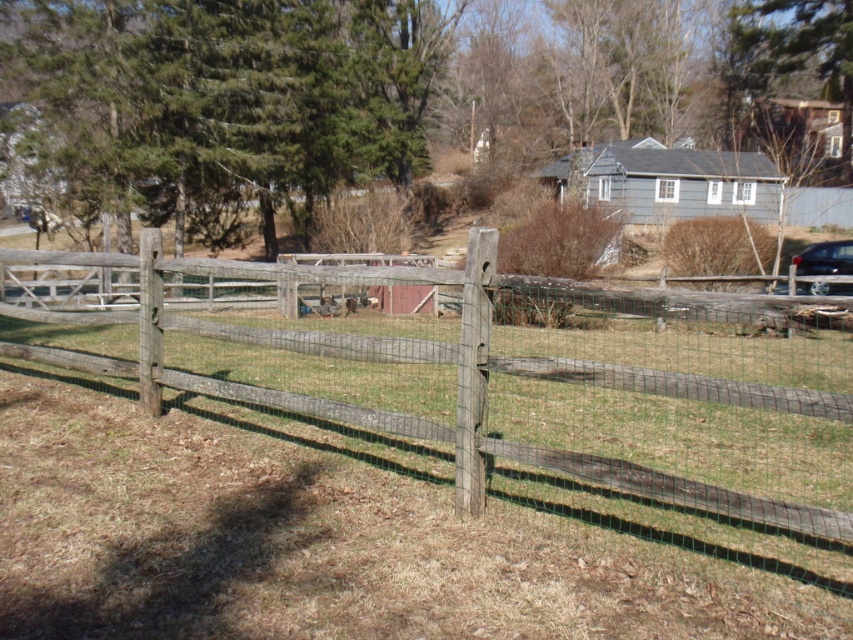
You are a delivery person trying to park your shiny black car at right close to the weathered wood fence at center. Can you park the car directly in front of the fence without any obstacles between them?

The weathered wood fence at center is positioned under the shiny black car at right, meaning the car is already parked over the fence. Since the fence is underneath the car, there is no space to park the car directly in front of the fence without overlapping them.

You are a delivery driver who needs to drive your shiny black car at right through a narrow path. The path is just wide enough for vehicles that are no wider than the weathered wood fence at center. Can your car fit through the path?

The weathered wood fence at center might be wider than shiny black car at right, so the path is possibly wide enough for the shiny black car at right to pass through.

Based on the photo, you are a delivery driver who needs to park your shiny black car at right as close as possible to the weathered wood fence at center without crossing a 40 feet safety zone. Can you park within the safety zone?

The distance between the weathered wood fence at center and the shiny black car at right is 37.95 feet, which is within the 40 feet safety zone. Therefore, you can park the shiny black car at right within the safety zone.